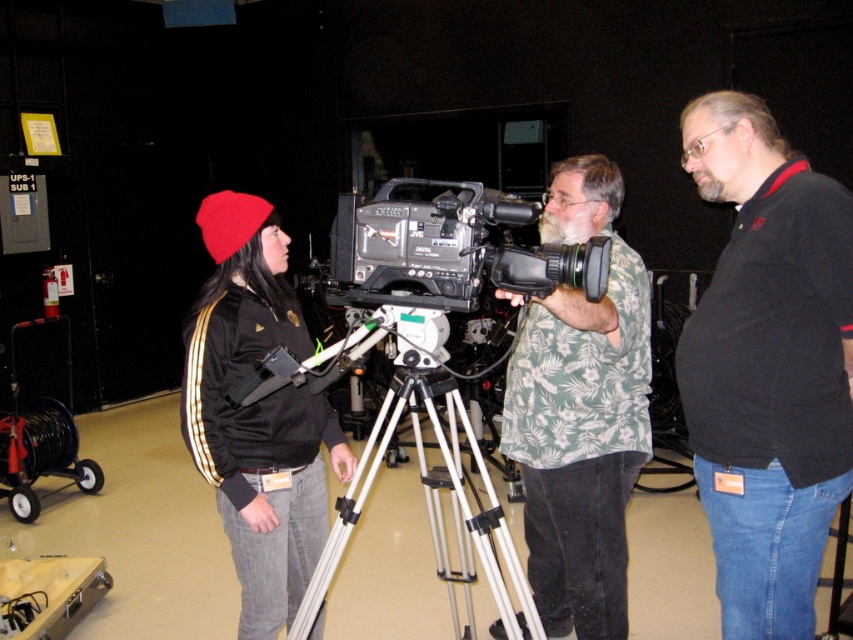
You are a production assistant in a film set. You need to move the shiny black jacket at center and the silver metallic tripod at center to make space for a new camera setup. Which object should you move first to free up more space?

The shiny black jacket at center occupies less space than the silver metallic tripod at center, so you should move the shiny black jacket at center first to free up more space.

You are standing in the studio and want to find the green floral shirt at center. According to the coordinates given, where should you look?

The green floral shirt at center is located at the 2D coordinates point (581, 412).

You are standing in the studio and need to locate the green floral shirt at center. According to the coordinates provided, where exactly is it positioned in the image?

The green floral shirt at center is located at point coordinates 0.645 on the x axis and 0.682 on the y axis.